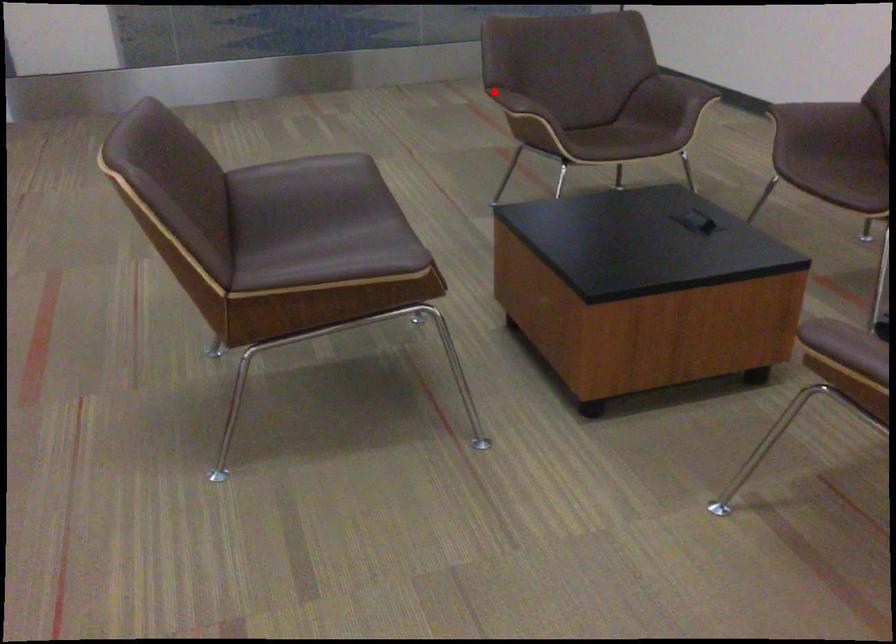
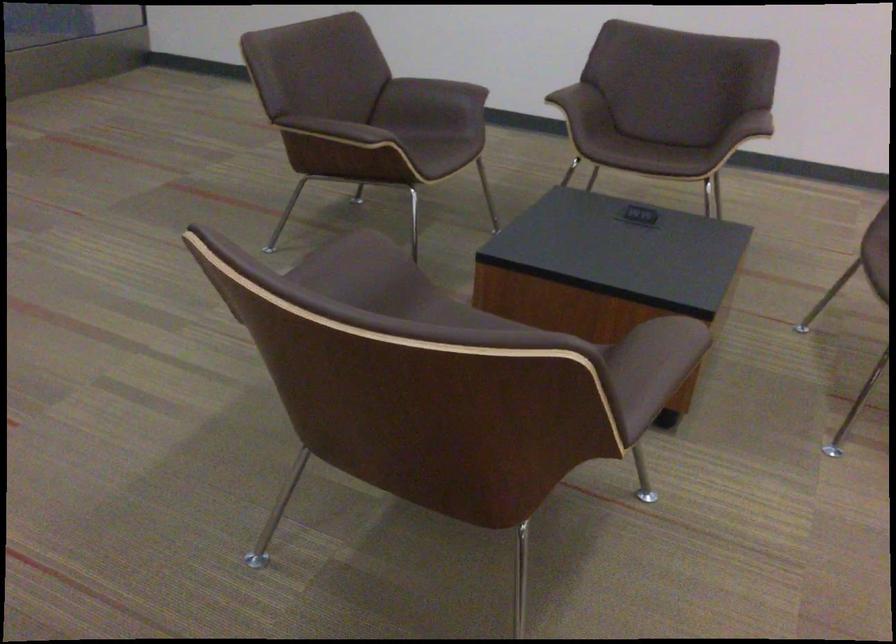
Question: A red point is marked in image1. In image2, is the corresponding 3D point closer to the camera or farther? Reply with the corresponding letter.

Choices:
 (A) The corresponding 3D point is closer.
 (B) The corresponding 3D point is farther.

Answer: (A)